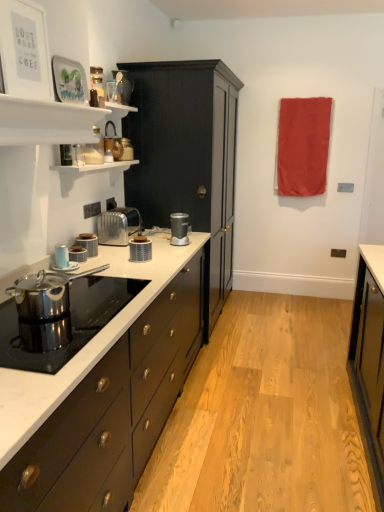
You are a GUI agent. You are given a task and a screenshot of the screen. Output one action in this format:
    pyautogui.click(x=<x>, y=<y>)
    Task: Click on the free space above red fabric towel at upper right (from a real-world perspective)
    
    Given the screenshot: What is the action you would take?
    pyautogui.click(x=305, y=97)